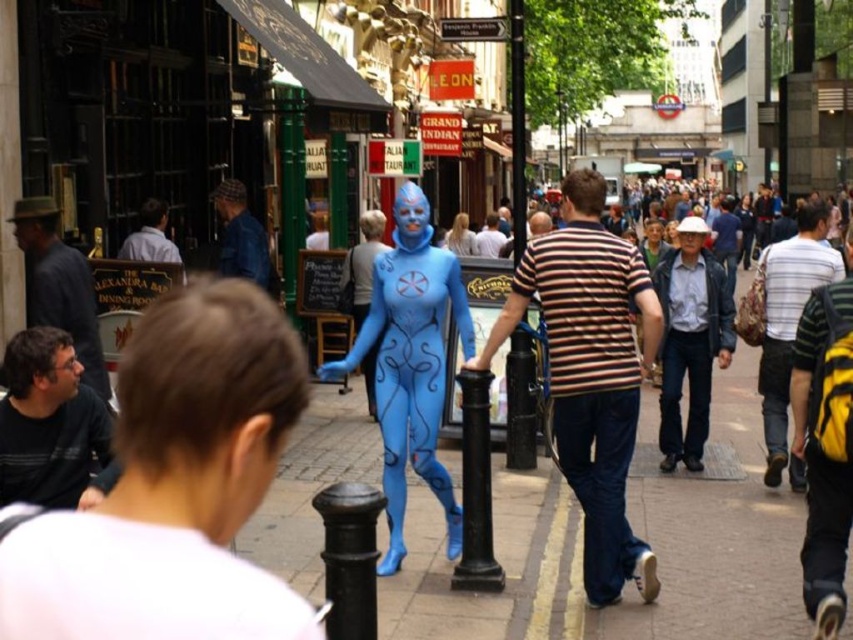
Can you confirm if dark gray shirt at left is positioned to the right of black metal pole at center?

No, dark gray shirt at left is not to the right of black metal pole at center.

Measure the distance between point (77, 589) and camera.

20.60 meters

Find the location of a particular element. dark gray shirt at left is located at coordinates (173, 486).

Where is `striped cotton shirt at right`? The image size is (853, 640). striped cotton shirt at right is located at coordinates (788, 324).

This screenshot has width=853, height=640. Describe the element at coordinates (788, 324) in the screenshot. I see `striped cotton shirt at right` at that location.

Locate an element on the screen. Image resolution: width=853 pixels, height=640 pixels. striped cotton shirt at right is located at coordinates (788, 324).

Is blue matte body paint at center thinner than striped cotton shirt at right?

Indeed, blue matte body paint at center has a lesser width compared to striped cotton shirt at right.

Is blue matte body paint at center further to camera compared to striped cotton shirt at right?

No, it is not.

Is point (402, 300) less distant than point (795, 336)?

Yes, point (402, 300) is in front of point (795, 336).

Find the location of a particular element. This screenshot has height=640, width=853. blue matte body paint at center is located at coordinates (410, 374).